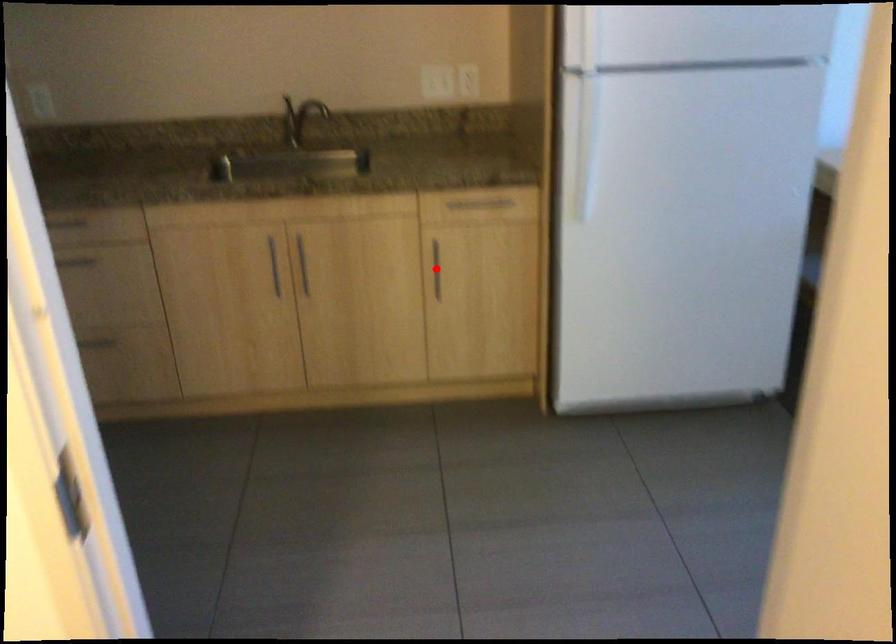
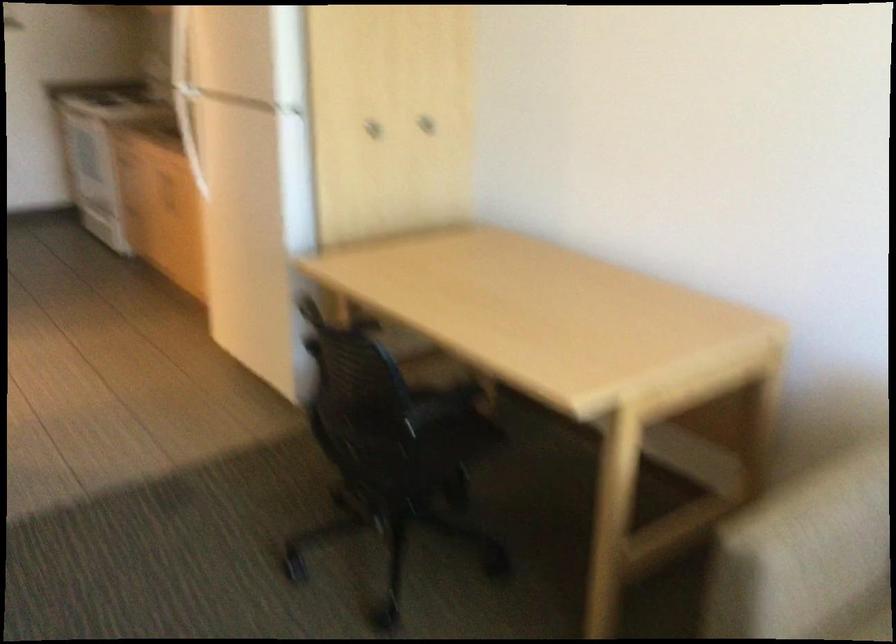
Question: I am providing you with two images of the same scene from different viewpoints. A red point is marked on the first image. At the location where the point appears in image 1, is it still visible in image 2?

Choices:
 (A) Yes
 (B) No

Answer: (B)